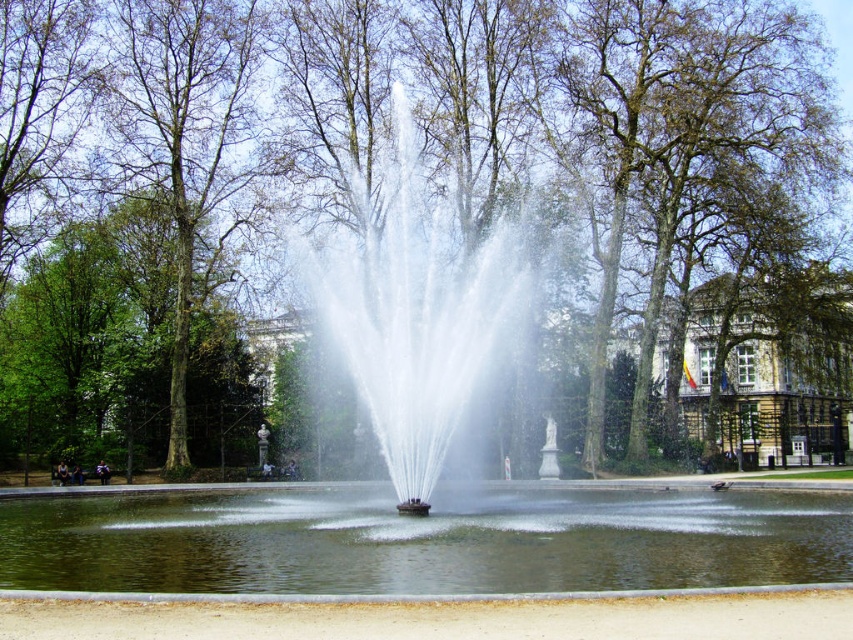
Question: Is clear water at center positioned behind clear water fountain at center?

Choices:
 (A) no
 (B) yes

Answer: (A)

Question: Does clear water at center have a lesser width compared to clear water fountain at center?

Choices:
 (A) no
 (B) yes

Answer: (A)

Question: Estimate the real-world distances between objects in this image. Which object is farther from the clear water fountain at center?

Choices:
 (A) brown stone building at center
 (B) clear water at center

Answer: (A)

Question: From the image, what is the correct spatial relationship of clear water fountain at center in relation to brown stone building at center?

Choices:
 (A) below
 (B) above

Answer: (B)

Question: Which of the following is the farthest from the observer?

Choices:
 (A) (669, 394)
 (B) (332, 296)
 (C) (148, 579)

Answer: (A)

Question: Estimate the real-world distances between objects in this image. Which object is farther from the brown stone building at center?

Choices:
 (A) clear water at center
 (B) clear water fountain at center

Answer: (A)